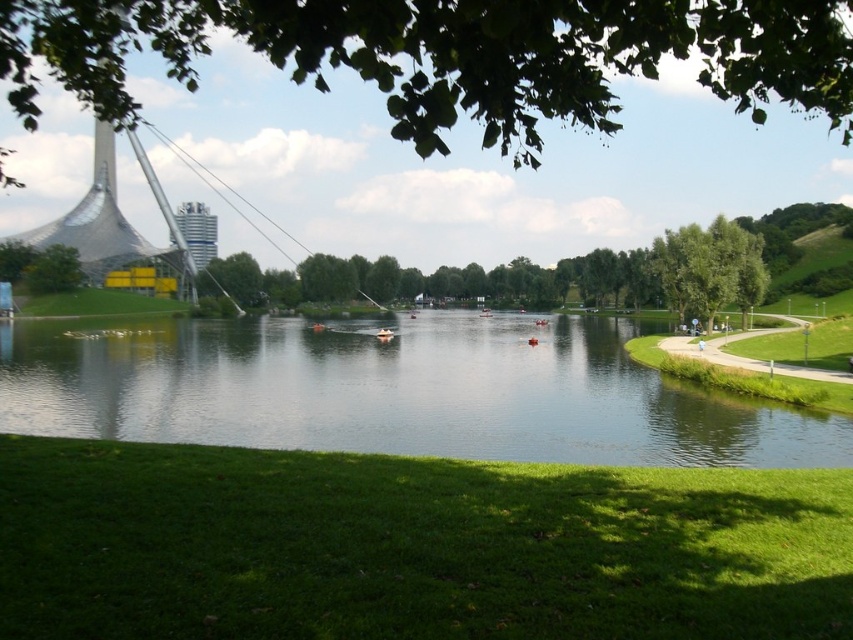
Question: Among these objects, which one is farthest from the camera?

Choices:
 (A) green leafy tree at upper center
 (B) green leafy tree at left
 (C) clear water at center
 (D) orange rubber boat at center

Answer: (B)

Question: Among these points, which one is farthest from the camera?

Choices:
 (A) (379, 328)
 (B) (62, 284)
 (C) (526, 365)

Answer: (B)

Question: Which point is farther to the camera?

Choices:
 (A) (36, 275)
 (B) (799, 99)

Answer: (A)

Question: Is clear water at center thinner than green leafy tree at upper center?

Choices:
 (A) yes
 (B) no

Answer: (A)

Question: Is clear water at center to the right of orange rubber boat at center from the viewer's perspective?

Choices:
 (A) no
 (B) yes

Answer: (B)

Question: Can you confirm if clear water at center is thinner than orange rubber boat at center?

Choices:
 (A) no
 (B) yes

Answer: (A)